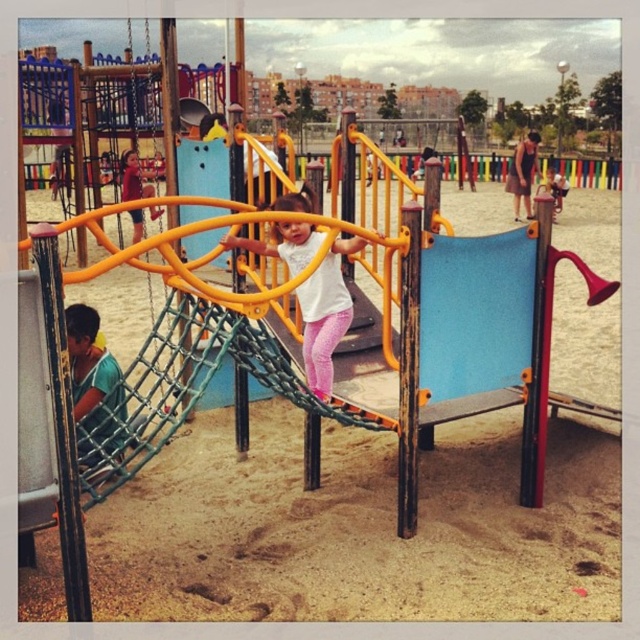
Which of these two, white matte shirt at center or matte red shirt at upper left, stands shorter?

Standing shorter between the two is white matte shirt at center.

Between white matte shirt at center and matte red shirt at upper left, which one appears on the left side from the viewer's perspective?

matte red shirt at upper left is more to the left.

Locate an element on the screen. The image size is (640, 640). white matte shirt at center is located at coordinates (324, 316).

Does blue matte slide at center have a greater height compared to white matte shirt at center?

Incorrect, blue matte slide at center's height is not larger of white matte shirt at center's.

Looking at this image, does blue matte slide at center appear on the left side of white matte shirt at center?

Incorrect, blue matte slide at center is not on the left side of white matte shirt at center.

I want to click on blue matte slide at center, so click(476, 312).

Looking at this image, does blue matte slide at center have a larger size compared to matte red shirt at upper left?

Actually, blue matte slide at center might be smaller than matte red shirt at upper left.

What do you see at coordinates (476, 312) in the screenshot? The width and height of the screenshot is (640, 640). I see `blue matte slide at center` at bounding box center [476, 312].

Locate an element on the screen. This screenshot has height=640, width=640. blue matte slide at center is located at coordinates (476, 312).

You are a GUI agent. You are given a task and a screenshot of the screen. Output one action in this format:
    pyautogui.click(x=<x>, y=<y>)
    Task: Click on the blue matte slide at center
    The width and height of the screenshot is (640, 640).
    Given the screenshot: What is the action you would take?
    pyautogui.click(x=476, y=312)